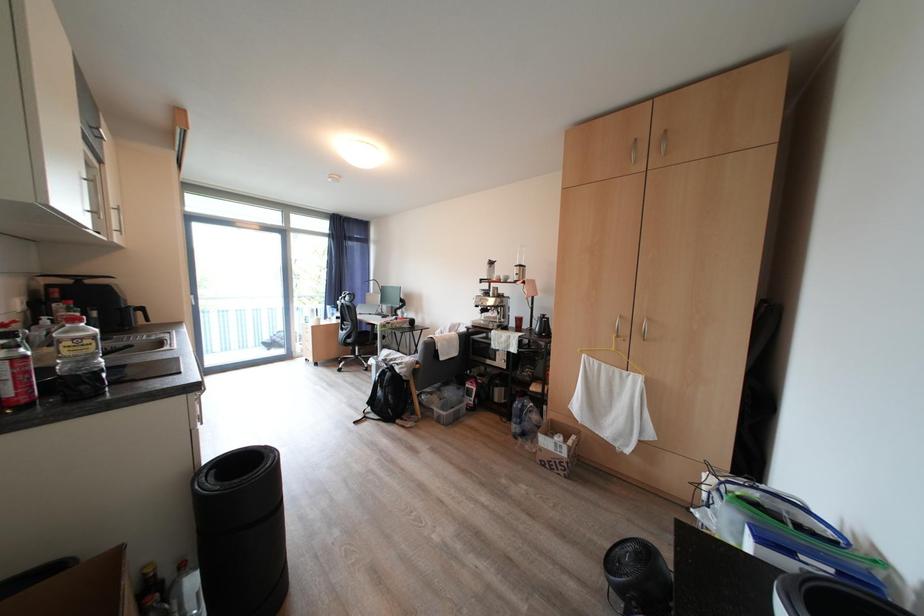
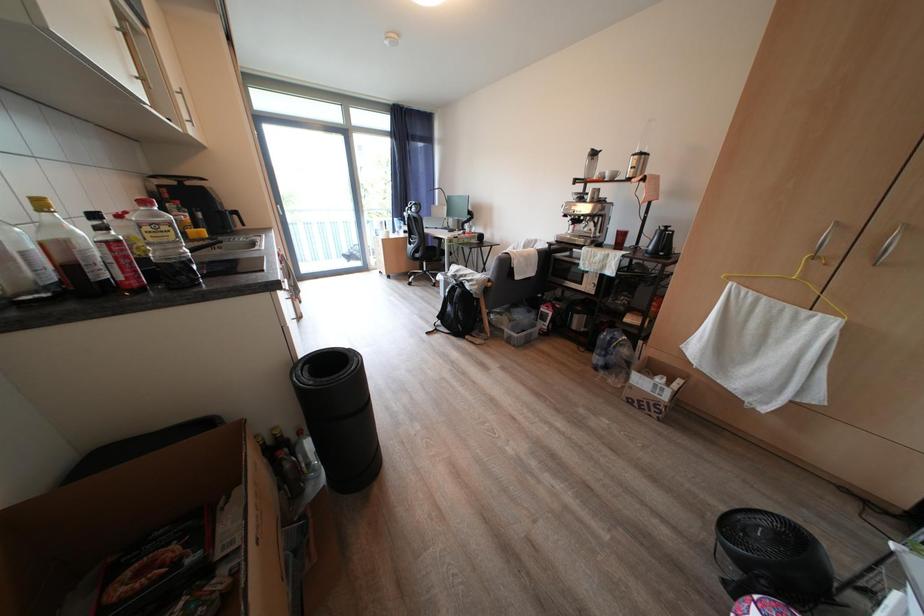
Question: The images are taken continuously from a first-person perspective. In which direction is your viewpoint rotating?

Choices:
 (A) Left
 (B) Right
 (C) Up
 (D) Down

Answer: (D)